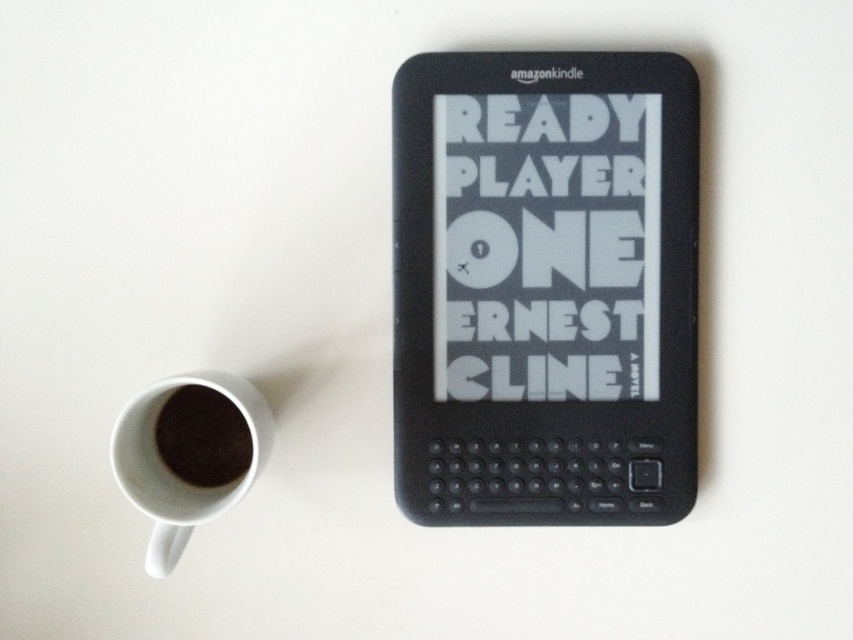
Question: Which of the following is the farthest from the observer?

Choices:
 (A) black matte e-reader at center
 (B) white ceramic mug at lower left
 (C) dark matte coffee cup at lower left

Answer: (A)

Question: Which object appears farthest from the camera in this image?

Choices:
 (A) black matte e-reader at center
 (B) dark matte coffee cup at lower left

Answer: (A)

Question: Observing the image, what is the correct spatial positioning of black matte e-reader at center in reference to dark matte coffee cup at lower left?

Choices:
 (A) left
 (B) right

Answer: (B)

Question: Is black matte e-reader at center wider than dark matte coffee cup at lower left?

Choices:
 (A) yes
 (B) no

Answer: (A)

Question: Which object is positioned farthest from the black matte e-reader at center?

Choices:
 (A) dark matte coffee cup at lower left
 (B) white ceramic mug at lower left

Answer: (A)

Question: Does black matte e-reader at center appear under dark matte coffee cup at lower left?

Choices:
 (A) no
 (B) yes

Answer: (A)